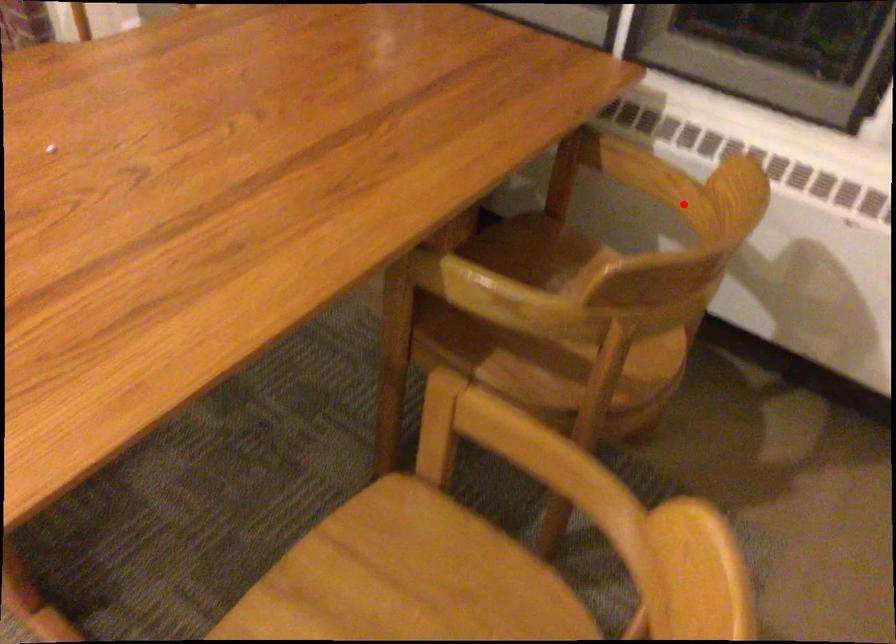
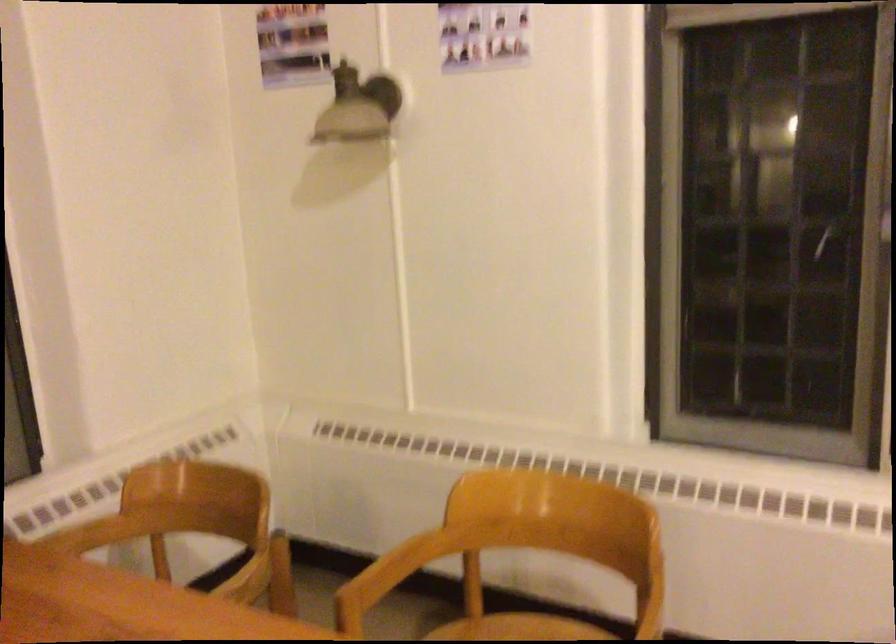
Question: I am providing you with two images of the same scene from different viewpoints. In image1, a red point is highlighted. Considering the same 3D point in image2, which of the following is correct?

Choices:
 (A) It is closer
 (B) It is farther

Answer: (B)